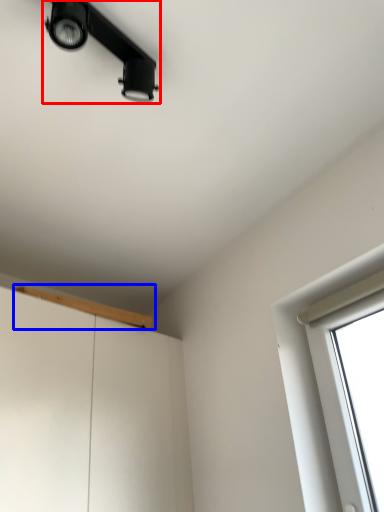
Question: Among these objects, which one is nearest to the camera, lamp (highlighted by a red box) or window sill (highlighted by a blue box)?

Choices:
 (A) lamp
 (B) window sill

Answer: (A)